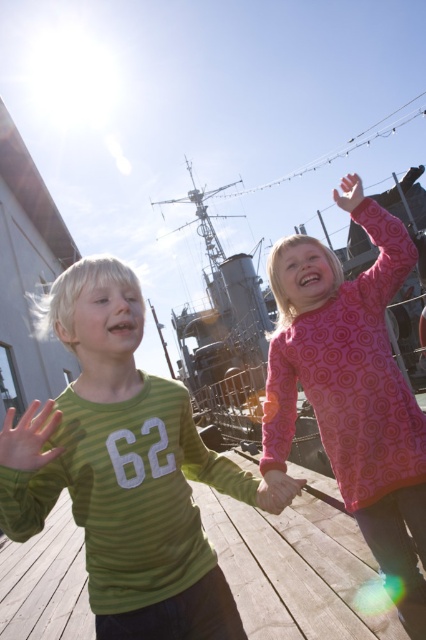
Question: Among these points, which one is nearest to the camera?

Choices:
 (A) (239, 397)
 (B) (276, 506)

Answer: (B)

Question: Is wooden at center positioned before metallic gray ship at center?

Choices:
 (A) yes
 (B) no

Answer: (A)

Question: Does wooden at center have a lesser width compared to pink matte hand at center?

Choices:
 (A) no
 (B) yes

Answer: (A)

Question: Which point appears closest to the camera in this image?

Choices:
 (A) (34, 444)
 (B) (357, 202)
 (C) (278, 500)

Answer: (A)

Question: Is wooden at center positioned behind pink matte hand at upper right?

Choices:
 (A) yes
 (B) no

Answer: (A)

Question: Among these points, which one is farthest from the camera?

Choices:
 (A) (14, 572)
 (B) (242, 298)
 (C) (48, 403)
 (D) (276, 476)

Answer: (B)